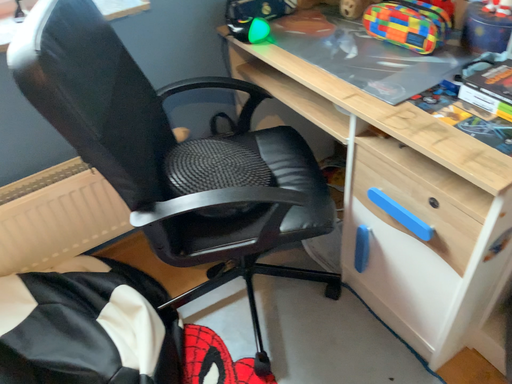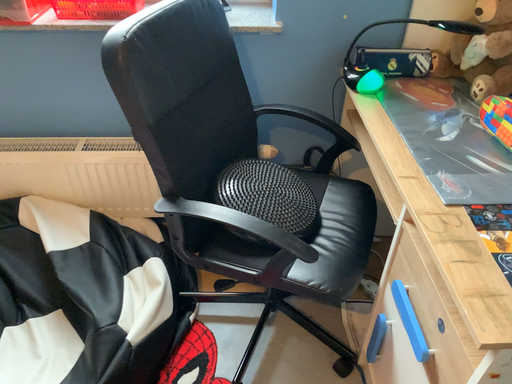
Question: How did the camera likely rotate when shooting the video?

Choices:
 (A) rotated upward
 (B) rotated downward

Answer: (A)